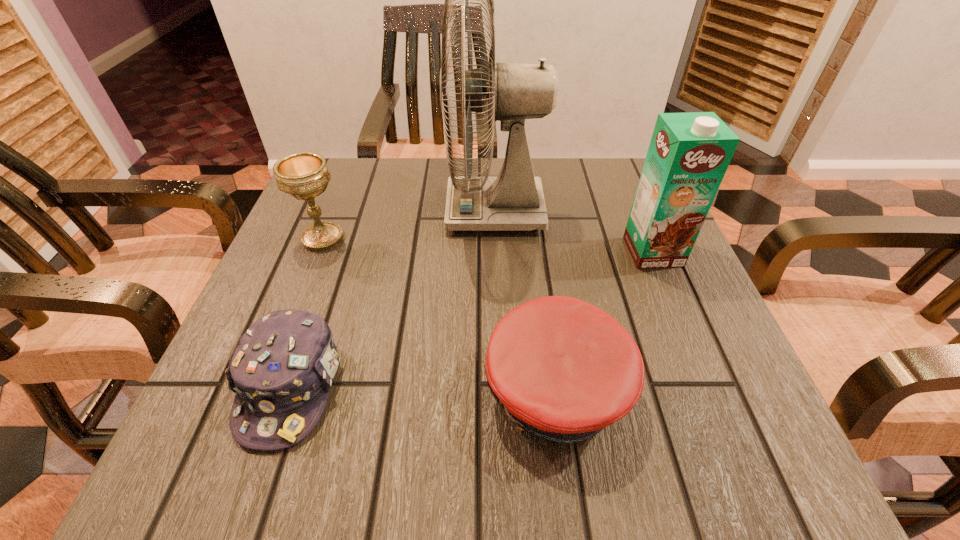
Image resolution: width=960 pixels, height=540 pixels. What are the coordinates of `vacant area that lies between the tallest object and the third shortest object` in the screenshot? It's located at (409, 225).

Locate an element on the screen. This screenshot has height=540, width=960. vacant point located between the third shortest object and the fan is located at coordinates (409, 225).

Find the location of a particular element. Image resolution: width=960 pixels, height=540 pixels. empty space between the carton and the left headwear is located at coordinates (471, 319).

At what (x,y) coordinates should I click in order to perform the action: click on vacant area between the fan and the chalice. Please return your answer as a coordinate pair (x, y). The image size is (960, 540). Looking at the image, I should click on (409, 225).

The image size is (960, 540). What are the coordinates of `vacant area between the left headwear and the carton` in the screenshot? It's located at pos(471,319).

Locate an element on the screen. the second closest object to the third shortest object is located at coordinates (513, 201).

The image size is (960, 540). I want to click on the fourth closest object relative to the fan, so (281, 371).

Identify the location of blank area in the image that satisfies the following two spatial constraints: 1. on the front-facing side of the tallest object; 2. on the front side of the third shortest object. The height and width of the screenshot is (540, 960). (496, 238).

At what (x,y) coordinates should I click in order to perform the action: click on free region that satisfies the following two spatial constraints: 1. on the front-facing side of the fan; 2. on the front side of the chalice. Please return your answer as a coordinate pair (x, y). Image resolution: width=960 pixels, height=540 pixels. Looking at the image, I should click on (496, 238).

I want to click on free point that satisfies the following two spatial constraints: 1. on the front side of the fourth shortest object; 2. on the right side of the third shortest object, so click(x=318, y=252).